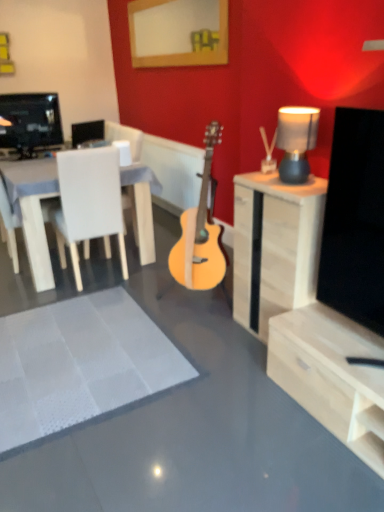
Question: From a real-world perspective, is light wood cabinet at right physically located above or below wooden picture frame at upper center?

Choices:
 (A) below
 (B) above

Answer: (A)

Question: Is light wood cabinet at right taller or shorter than wooden picture frame at upper center?

Choices:
 (A) short
 (B) tall

Answer: (B)

Question: Which is nearer to the light wood cabinet at right?

Choices:
 (A) wooden picture frame at upper center
 (B) white matte chair at left
 (C) light wood acoustic guitar at center
 (D) matte gray lampshade at upper right
 (E) white textured rug at center

Answer: (D)

Question: Which of these objects is positioned farthest from the white matte chair at left?

Choices:
 (A) wooden picture frame at upper center
 (B) light wood cabinet at right
 (C) white textured rug at center
 (D) matte gray lampshade at upper right
 (E) light wood acoustic guitar at center

Answer: (A)